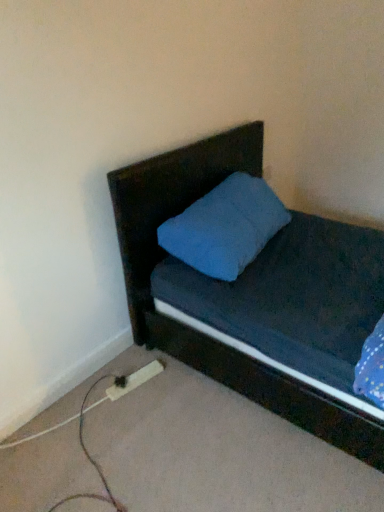
This screenshot has width=384, height=512. Identify the location of unoccupied region to the right of wooden extension cord at lower left. (166, 378).